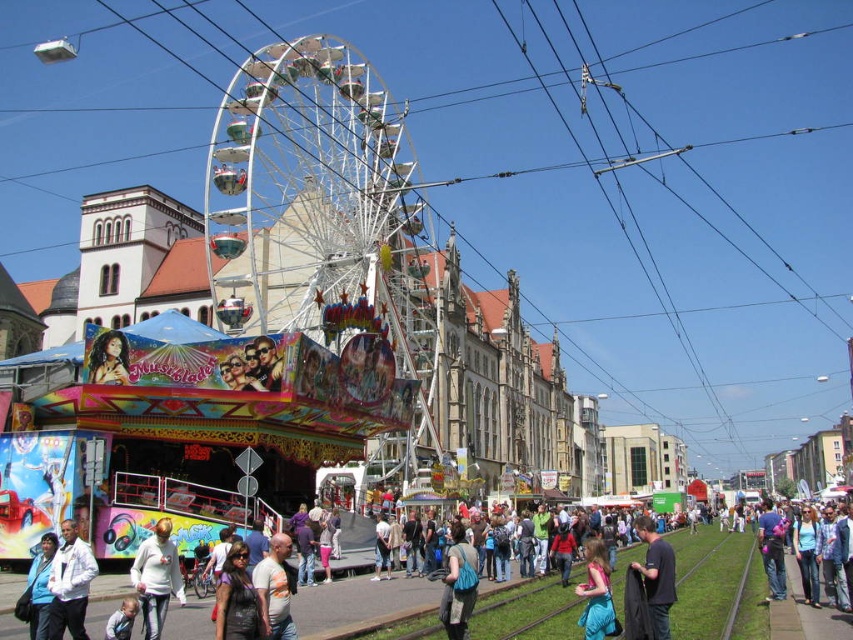
You are standing at the base of the Ferris wheel and see both the white cotton sweater at center and the dark blue jeans at lower right. Which object is closer to you?

The dark blue jeans at lower right are closer to you since the white cotton sweater at center is 25.39 meters away from them, meaning the sweater is farther away than the jeans.

Looking at this image, you are a photographer at the Musikfestival trying to capture a photo of the shiny metallic ferris wheel at center and dark blue jeans at lower right. Which object should you focus on first if you want to include both in the same frame without zooming in or out?

The shiny metallic ferris wheel at center is bigger than dark blue jeans at lower right, so you should focus on the shiny metallic ferris wheel at center first to ensure it fits in the frame before adjusting for the smaller dark blue jeans at lower right.